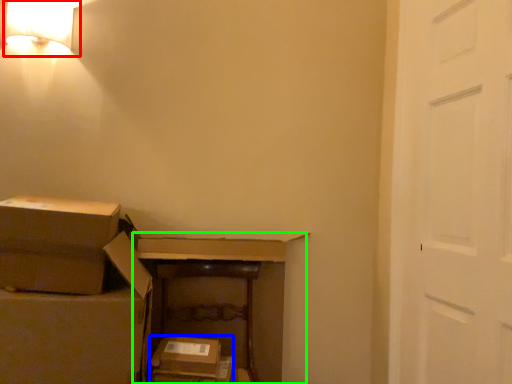
Question: Based on their relative distances, which object is nearer to lamp (highlighted by a red box)? Choose from storage box (highlighted by a blue box) and dresser (highlighted by a green box).

Choices:
 (A) storage box
 (B) dresser

Answer: (B)